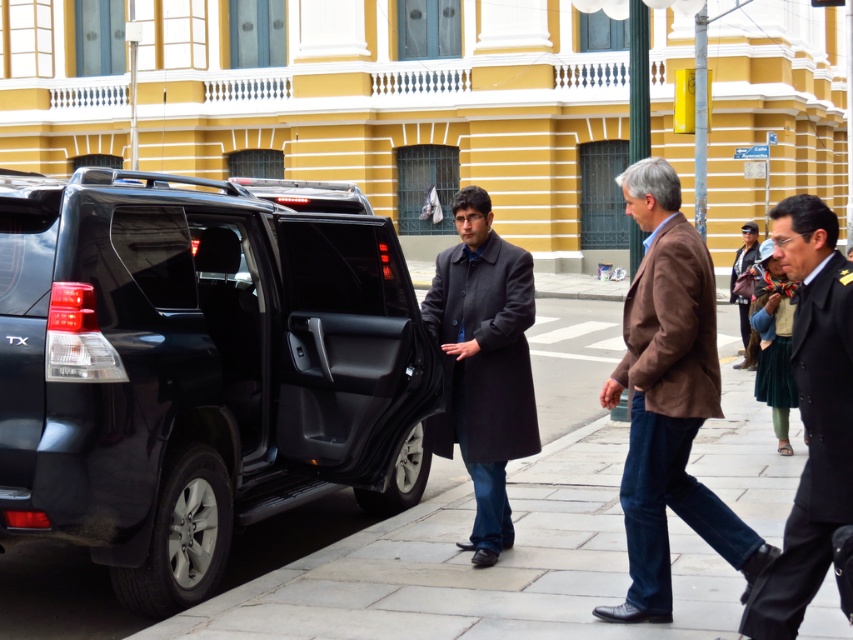
Question: Which of the following is the farthest from the observer?

Choices:
 (A) dark blue uniform at center
 (B) dark gray wool coat at center
 (C) brown woolen jacket at center
 (D) dark brown leather jacket at center

Answer: (D)

Question: Can you confirm if dark blue uniform at center is positioned to the right of dark brown leather jacket at center?

Choices:
 (A) no
 (B) yes

Answer: (A)

Question: Where is brown woolen jacket at center located in relation to dark brown leather jacket at center in the image?

Choices:
 (A) below
 (B) above

Answer: (A)

Question: Among these objects, which one is nearest to the camera?

Choices:
 (A) paved stone sidewalk at center
 (B) dark blue uniform at center
 (C) shiny black minivan at center
 (D) brown woolen jacket at center

Answer: (B)

Question: Which of these objects is positioned farthest from the dark brown leather jacket at center?

Choices:
 (A) dark blue uniform at center
 (B) shiny black minivan at center
 (C) dark gray wool coat at center
 (D) paved stone sidewalk at center

Answer: (A)

Question: Is shiny black minivan at center further to the viewer compared to dark brown leather jacket at center?

Choices:
 (A) yes
 (B) no

Answer: (B)